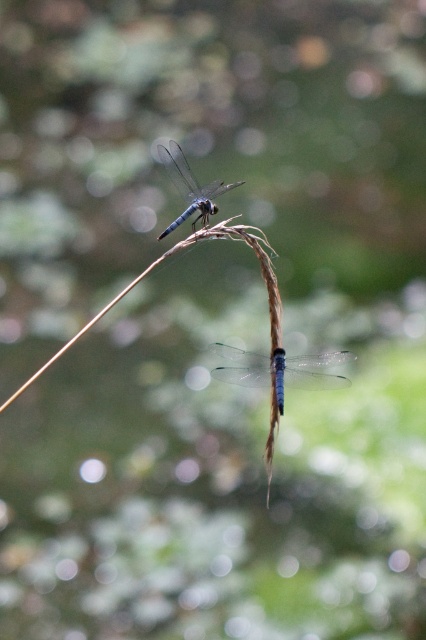
You are an entomologist observing two dragonflies. You have a ruler that measures in centimeters. Which dragonfly, the transparent blue dragonfly at center or the blue translucent dragonfly at upper center, would you measure to have a greater width?

The transparent blue dragonfly at center has a greater width than the blue translucent dragonfly at upper center according to the description.

You are a photographer trying to capture a closeup of the dragonflies. If you focus on the transparent blue dragonfly at center, will the blue translucent dragonfly at upper center also be in focus? Explain your reasoning based on their positions.

The transparent blue dragonfly at center is in front of the blue translucent dragonfly at upper center. Since focusing on the front dragonfly would likely keep the one behind slightly out of focus, especially with the bokeh effect mentioned in the scene, the blue translucent dragonfly at upper center may not be in focus.

You are a photographer trying to capture the dragonflies in the image. You want to adjust your camera to focus on the transparent blue dragonfly at center and the blue translucent dragonfly at upper center. Which dragonfly should you focus on first if you want to start with the one that is positioned to the left?

The blue translucent dragonfly at upper center is to the left of the transparent blue dragonfly at center, so you should focus on the blue translucent dragonfly at upper center first.